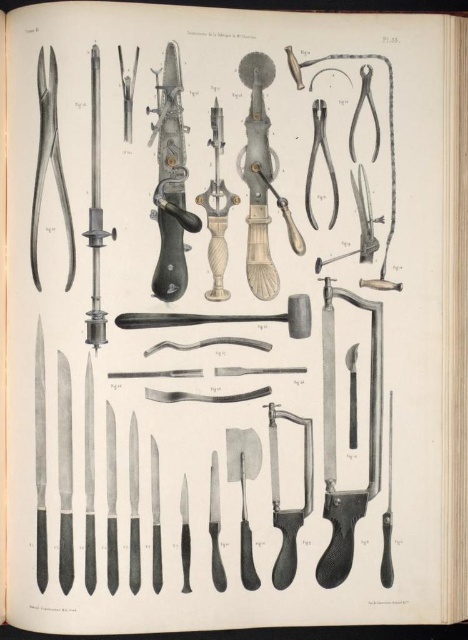
You are a medical student preparing for a surgery and need to choose between the matte silver razor at left and the matte silver razor at upper right. Which one is bigger?

The matte silver razor at left is larger in size compared to the matte silver razor at upper right.

You are looking at a medical textbook illustration labeled Pl. 55. There are two points marked on the page at coordinates point (66,282) and point (367,216). Based on their positions, which point is closer to you as you view the illustration?

Point (66,282) is closer to the camera than point (367,216), so the point closer to you is point (66,282).

You are a medical student preparing for a surgery and need to choose between the matte silver razor at left and the matte silver razor at upper right. Which one is wider?

The matte silver razor at upper right is wider than the matte silver razor at left.